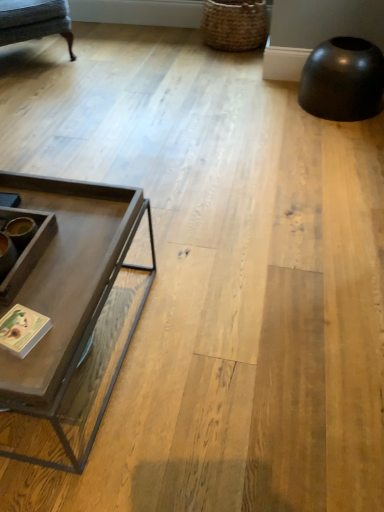
Where is `vacant space in front of textured gray fabric swivel chair at upper left`? The image size is (384, 512). vacant space in front of textured gray fabric swivel chair at upper left is located at coordinates (49, 89).